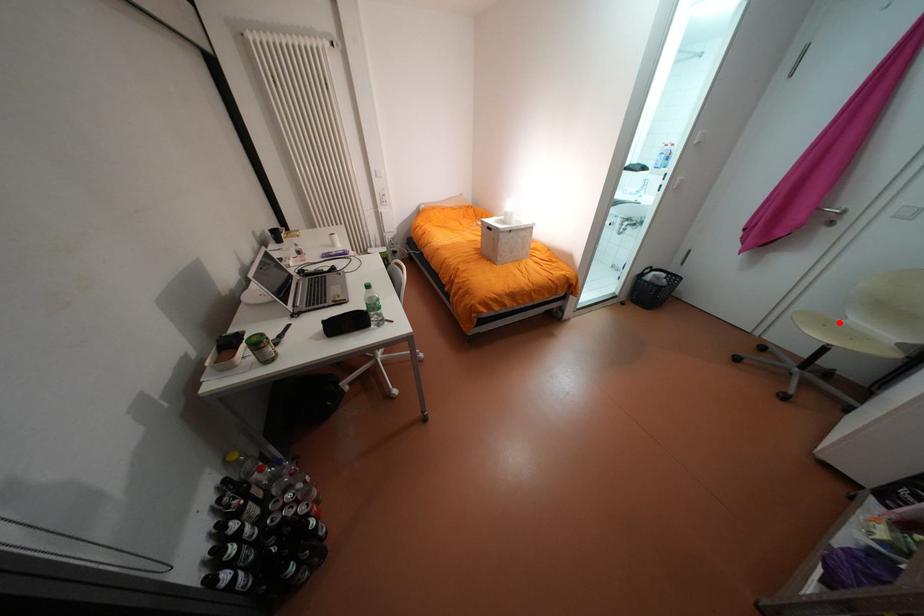
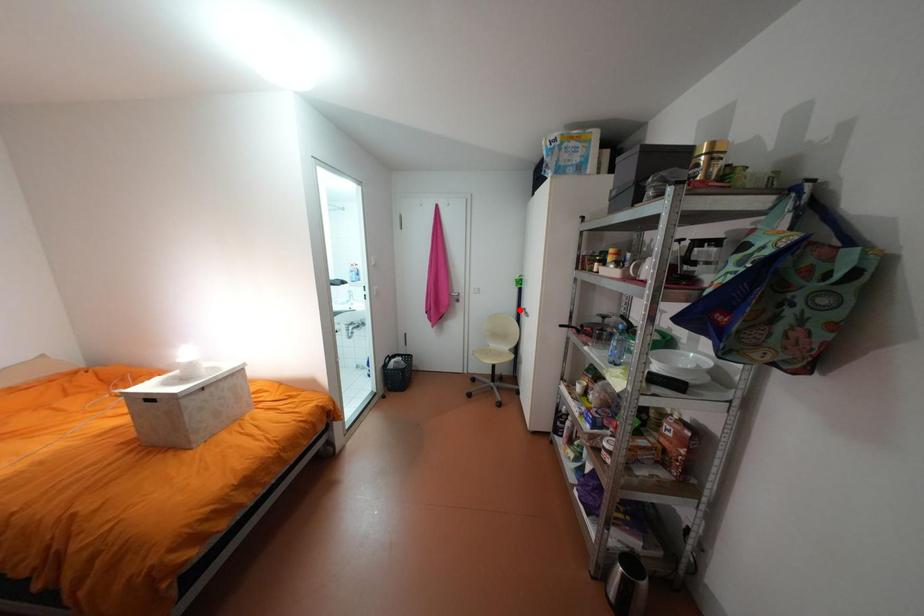
I am providing you with two images of the same scene from different viewpoints. A red point is marked on the first image and another point is marked on the second image. Are the points marked in image1 and image2 representing the same 3D position?

No